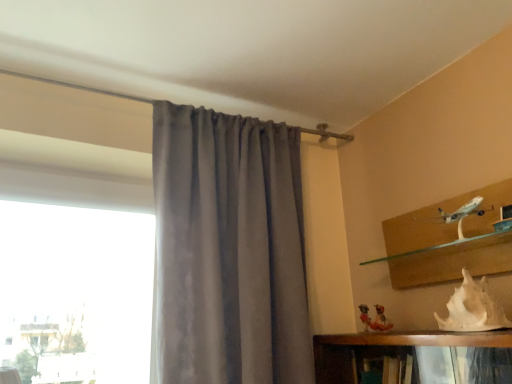
Question: From the image's perspective, is white matte seashell at lower right located beneath satin gray curtain at center?

Choices:
 (A) yes
 (B) no

Answer: (A)

Question: From a real-world perspective, does white matte seashell at lower right stand above satin gray curtain at center?

Choices:
 (A) yes
 (B) no

Answer: (B)

Question: Does white matte seashell at lower right have a smaller size compared to satin gray curtain at center?

Choices:
 (A) no
 (B) yes

Answer: (B)

Question: Is there a large distance between white matte seashell at lower right and satin gray curtain at center?

Choices:
 (A) no
 (B) yes

Answer: (A)

Question: Is the surface of white matte seashell at lower right in direct contact with satin gray curtain at center?

Choices:
 (A) yes
 (B) no

Answer: (B)

Question: Is white matte seashell at lower right surrounding satin gray curtain at center?

Choices:
 (A) yes
 (B) no

Answer: (B)

Question: Is satin gray curtain at center facing away from white matte seashell at lower right?

Choices:
 (A) no
 (B) yes

Answer: (A)

Question: Considering the relative sizes of satin gray curtain at center and white matte seashell at lower right in the image provided, is satin gray curtain at center bigger than white matte seashell at lower right?

Choices:
 (A) no
 (B) yes

Answer: (B)

Question: Is satin gray curtain at center at the right side of white matte seashell at lower right?

Choices:
 (A) yes
 (B) no

Answer: (B)

Question: Is satin gray curtain at center surrounding white matte seashell at lower right?

Choices:
 (A) no
 (B) yes

Answer: (A)

Question: From a real-world perspective, is satin gray curtain at center on top of white matte seashell at lower right?

Choices:
 (A) yes
 (B) no

Answer: (A)

Question: Is satin gray curtain at center positioned far away from white matte seashell at lower right?

Choices:
 (A) no
 (B) yes

Answer: (A)

Question: Is point (207, 243) closer or farther from the camera than point (458, 301)?

Choices:
 (A) closer
 (B) farther

Answer: (B)